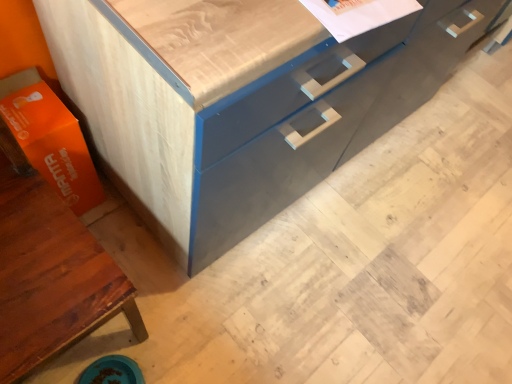
The width and height of the screenshot is (512, 384). Find the location of `vacant area that is situated to the right of orange matte cardboard box at lower left`. vacant area that is situated to the right of orange matte cardboard box at lower left is located at coordinates (117, 228).